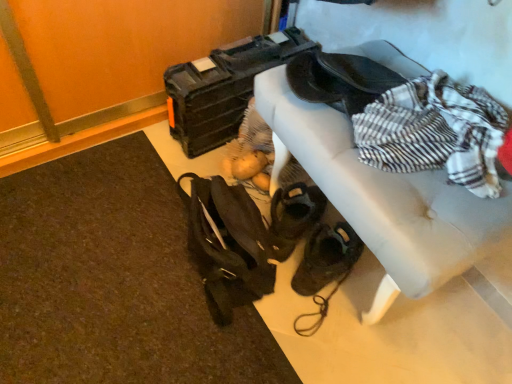
What are the coordinates of `matte black toolbox at upper center` in the screenshot? It's located at (223, 88).

Where is `dark brown leather messenger bag at lower center`? The image size is (512, 384). dark brown leather messenger bag at lower center is located at coordinates (227, 245).

Where is `leather couch at upper right`? Image resolution: width=512 pixels, height=384 pixels. leather couch at upper right is located at coordinates (390, 201).

Which object is wider, matte black toolbox at upper center or leather couch at upper right?

With larger width is matte black toolbox at upper center.

From a real-world perspective, is matte black toolbox at upper center positioned above or below leather couch at upper right?

matte black toolbox at upper center is below leather couch at upper right.

Are matte black toolbox at upper center and leather couch at upper right beside each other?

matte black toolbox at upper center is not next to leather couch at upper right, and they're not touching.

Is the surface of leather couch at upper right in direct contact with matte black toolbox at upper center?

They are not placed beside each other.

How different are the orientations of leather couch at upper right and matte black toolbox at upper center in degrees?

The facing directions of leather couch at upper right and matte black toolbox at upper center are 3.45 degrees apart.

In the image, there is a leather couch at upper right. What are the coordinates of `luggage below it (from a real-world perspective)` in the screenshot? It's located at (223, 88).

Is leather couch at upper right situated inside matte black toolbox at upper center or outside?

leather couch at upper right is outside matte black toolbox at upper center.

Is dark brown leather messenger bag at lower center oriented towards leather couch at upper right?

No, dark brown leather messenger bag at lower center is not oriented towards leather couch at upper right.

Considering the sizes of objects dark brown leather messenger bag at lower center and leather couch at upper right in the image provided, who is taller, dark brown leather messenger bag at lower center or leather couch at upper right?

leather couch at upper right is taller.

Are dark brown leather messenger bag at lower center and leather couch at upper right beside each other?

No, dark brown leather messenger bag at lower center is not beside leather couch at upper right.

From the image's perspective, which is above, dark brown leather messenger bag at lower center or leather couch at upper right?

leather couch at upper right appears higher in the image.

Considering the relative sizes of matte black toolbox at upper center and dark brown leather messenger bag at lower center in the image provided, is matte black toolbox at upper center wider than dark brown leather messenger bag at lower center?

Yes.

Which is correct: matte black toolbox at upper center is inside dark brown leather messenger bag at lower center, or outside of it?

matte black toolbox at upper center is outside dark brown leather messenger bag at lower center.

Considering the relative sizes of matte black toolbox at upper center and dark brown leather messenger bag at lower center in the image provided, is matte black toolbox at upper center bigger than dark brown leather messenger bag at lower center?

Correct, matte black toolbox at upper center is larger in size than dark brown leather messenger bag at lower center.

Is point (207, 77) closer or farther from the camera than point (274, 271)?

Point (207, 77) is positioned farther from the camera compared to point (274, 271).

How distant is dark brown leather messenger bag at lower center from matte black toolbox at upper center?

dark brown leather messenger bag at lower center and matte black toolbox at upper center are 17.90 inches apart.

Considering the sizes of objects dark brown leather messenger bag at lower center and matte black toolbox at upper center in the image provided, who is wider, dark brown leather messenger bag at lower center or matte black toolbox at upper center?

matte black toolbox at upper center is wider.

This screenshot has height=384, width=512. I want to click on luggage on the right of dark brown leather messenger bag at lower center, so click(x=223, y=88).

From the image's perspective, is dark brown leather messenger bag at lower center above or below matte black toolbox at upper center?

Clearly, from the image's perspective, dark brown leather messenger bag at lower center is below matte black toolbox at upper center.

Considering the relative positions of leather couch at upper right and dark brown leather messenger bag at lower center in the image provided, is leather couch at upper right to the right of dark brown leather messenger bag at lower center from the viewer's perspective?

Correct, you'll find leather couch at upper right to the right of dark brown leather messenger bag at lower center.

Does point (336, 115) come closer to viewer compared to point (264, 270)?

Yes, point (336, 115) is closer to viewer.

Is leather couch at upper right inside the boundaries of dark brown leather messenger bag at lower center, or outside?

leather couch at upper right cannot be found inside dark brown leather messenger bag at lower center.

This screenshot has height=384, width=512. Identify the location of furniture that appears on the right of matte black toolbox at upper center. (390, 201).

Locate an element on the screen. This screenshot has width=512, height=384. furniture below the matte black toolbox at upper center (from the image's perspective) is located at coordinates (390, 201).

When comparing their distances from leather couch at upper right, does matte black toolbox at upper center or dark brown leather messenger bag at lower center seem closer?

Based on the image, dark brown leather messenger bag at lower center appears to be nearer to leather couch at upper right.

Looking at the image, which one is located closer to dark brown leather messenger bag at lower center, leather couch at upper right or matte black toolbox at upper center?

leather couch at upper right lies closer to dark brown leather messenger bag at lower center than the other object.

From the picture: From the image, which object appears to be farther from matte black toolbox at upper center, leather couch at upper right or dark brown leather messenger bag at lower center?

The object further to matte black toolbox at upper center is dark brown leather messenger bag at lower center.

When comparing their distances from dark brown leather messenger bag at lower center, does matte black toolbox at upper center or leather couch at upper right seem closer?

leather couch at upper right.

When comparing their distances from matte black toolbox at upper center, does dark brown leather messenger bag at lower center or leather couch at upper right seem closer?

leather couch at upper right lies closer to matte black toolbox at upper center than the other object.

Based on their spatial positions, is dark brown leather messenger bag at lower center or matte black toolbox at upper center closer to leather couch at upper right?

Based on the image, dark brown leather messenger bag at lower center appears to be nearer to leather couch at upper right.

This screenshot has width=512, height=384. What are the coordinates of `furniture between matte black toolbox at upper center and dark brown leather messenger bag at lower center from top to bottom` in the screenshot? It's located at (390, 201).